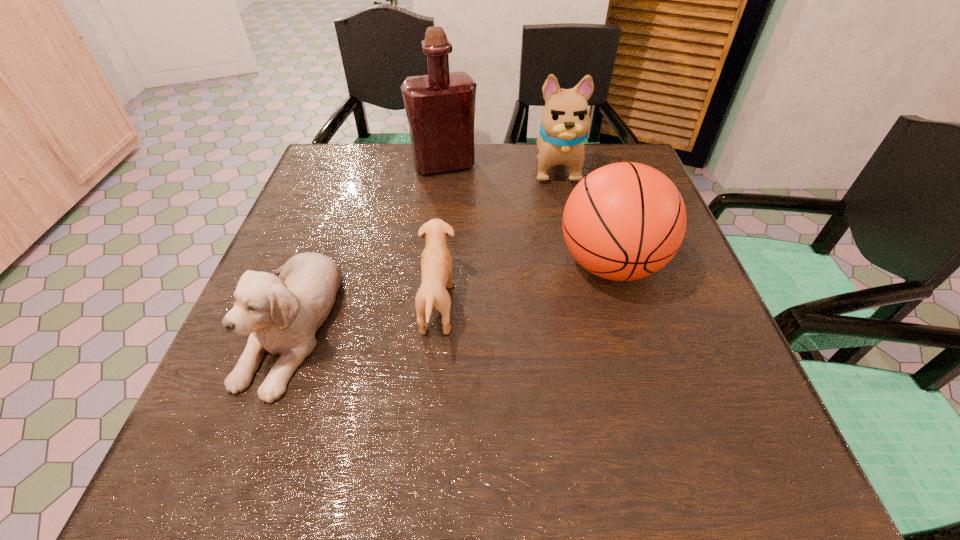
This screenshot has height=540, width=960. I want to click on object that is the third closest to the liquor, so 436,262.

This screenshot has width=960, height=540. In order to click on puppy that can be found as the second closest to the farthest puppy in this screenshot , I will do `click(282, 314)`.

Identify which puppy is the closest to the tallest object. Please provide its 2D coordinates. Your answer should be formatted as a tuple, i.e. [(x, y)], where the tuple contains the x and y coordinates of a point satisfying the conditions above.

[(565, 118)]

The width and height of the screenshot is (960, 540). In order to click on vacant space that satisfies the following two spatial constraints: 1. on the face of the farthest puppy; 2. on the right side of the basketball in this screenshot , I will do `click(577, 265)`.

In order to click on free space that satisfies the following two spatial constraints: 1. on the left side of the shortest object; 2. on the front-facing side of the leftmost puppy in this screenshot , I will do `click(436, 323)`.

Identify the location of vacant space that satisfies the following two spatial constraints: 1. on the front side of the basketball; 2. on the left side of the liquor. The width and height of the screenshot is (960, 540). (434, 265).

What are the coordinates of `free location that satisfies the following two spatial constraints: 1. on the face of the tallest puppy; 2. on the left side of the shortest object` in the screenshot? It's located at (587, 305).

Identify the location of blank area in the image that satisfies the following two spatial constraints: 1. on the face of the basketball; 2. on the right side of the tallest puppy. This screenshot has height=540, width=960. (577, 265).

At what (x,y) coordinates should I click in order to perform the action: click on blank space that satisfies the following two spatial constraints: 1. on the left side of the shortest object; 2. on the front-facing side of the second shortest puppy. Please return your answer as a coordinate pair (x, y). Image resolution: width=960 pixels, height=540 pixels. Looking at the image, I should click on (436, 323).